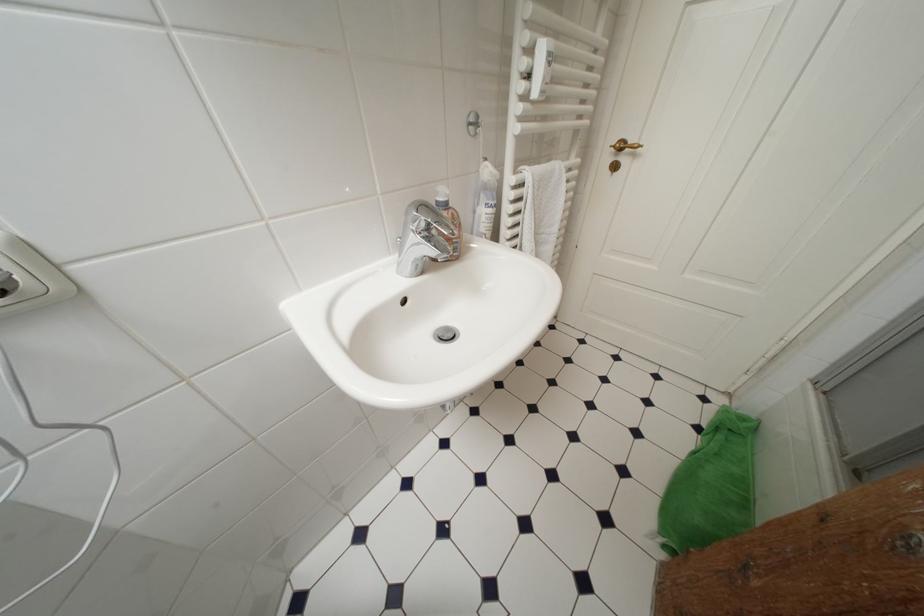
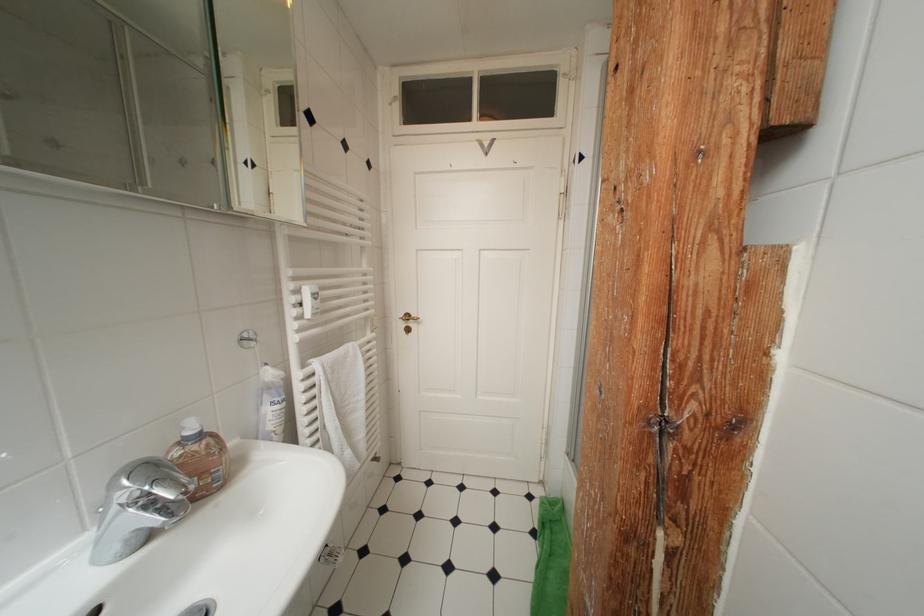
The point at (452, 216) is marked in the first image. Where is the corresponding point in the second image?

(201, 451)